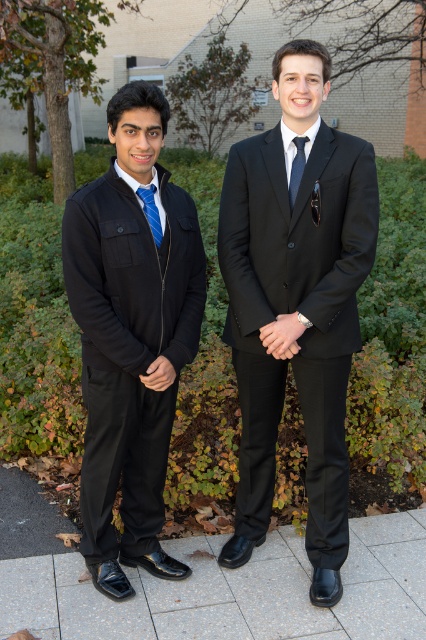
You are a photographer adjusting the camera settings to ensure both the matte black suit at center and the dark blue silk tie at center are in focus. Given their height difference, which object should you focus on first to ensure proper depth of field?

The matte black suit at center is much taller than the dark blue silk tie at center, so you should focus on the matte black suit at center first to ensure proper depth of field.

You are standing at point point (374,246) and want to take a photo of the two people in front of the building. The camera you have can focus on objects within 2 meters. Will the camera be able to focus on them?

The distance between point (374,246) and the camera is 2.12 meters, which is beyond the camera focus range of 2 meters. Therefore, the camera will not be able to focus on them.